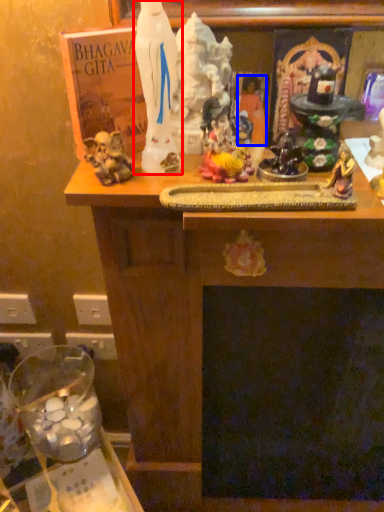
Question: Which object appears farthest to the camera in this image, statue (highlighted by a red box) or person (highlighted by a blue box)?

Choices:
 (A) statue
 (B) person

Answer: (B)